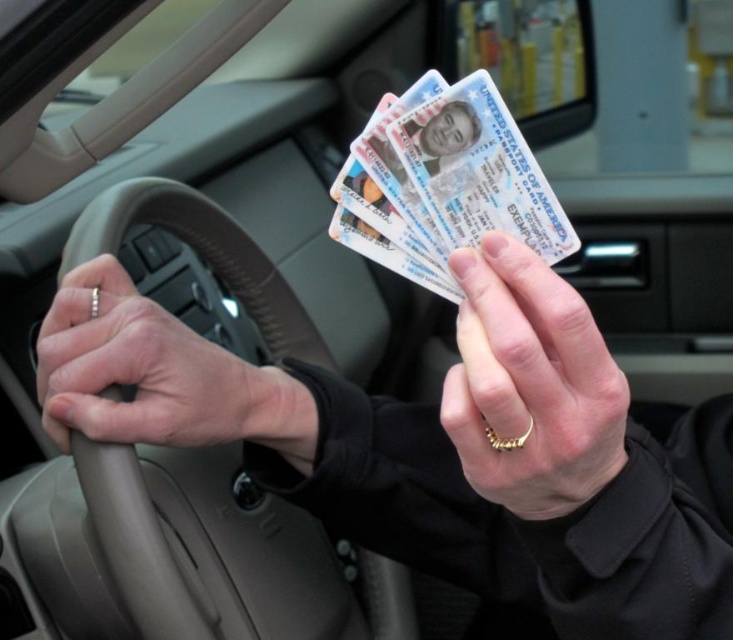
You are a photographer taking a picture of two gold rings inside a car. You notice the gold ring at center and the gold ring at left. Which one should you focus on if you want to capture the larger ring more clearly?

The gold ring at left is larger, so focusing on it would capture the larger ring more clearly.

Consider the image. You are a photographer trying to capture the gold ring at center in the image. The photographer wants to ensure that the ring is centered in the frame. Given the coordinates provided in the scene, can you confirm if the point at (530, 385) is the correct location for the center of the gold ring?

Yes, the point at (530, 385) corresponds to the gold ring at center, so it is the correct location for the center of the gold ring.

You are a security guard checking IDs at a venue entrance. You notice a person in a black jacket holding up their ID cards. The gold ring at left on their hand and the white plastic id cards at center are visible. Which object is bigger in size?

The gold ring at left has a larger size compared to the white plastic id cards at center.